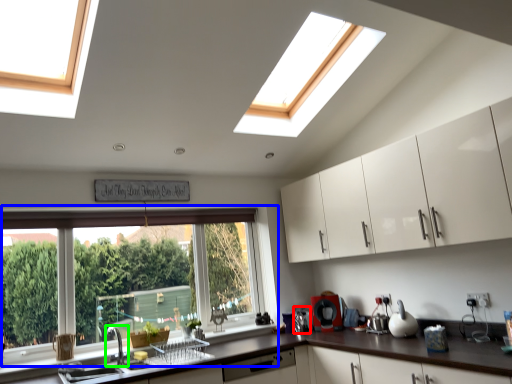
Question: Estimate the real-world distances between objects in this image. Which object is closer to appliance (highlighted by a red box), window (highlighted by a blue box) or tap (highlighted by a green box)?

Choices:
 (A) window
 (B) tap

Answer: (A)